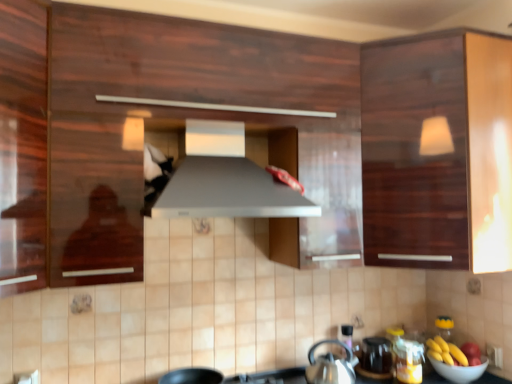
Question: Can we say matte black kettle at lower center lies outside glossy wood cabinet at upper right?

Choices:
 (A) no
 (B) yes

Answer: (B)

Question: Are matte black kettle at lower center and glossy wood cabinet at upper right located far from each other?

Choices:
 (A) yes
 (B) no

Answer: (B)

Question: Is matte black kettle at lower center turned away from glossy wood cabinet at upper right?

Choices:
 (A) yes
 (B) no

Answer: (B)

Question: Does matte black kettle at lower center have a lesser width compared to glossy wood cabinet at upper right?

Choices:
 (A) no
 (B) yes

Answer: (B)

Question: From the image's perspective, is matte black kettle at lower center above glossy wood cabinet at upper right?

Choices:
 (A) no
 (B) yes

Answer: (A)

Question: Considering the positions of point (434, 350) and point (262, 198), is point (434, 350) closer or farther from the camera than point (262, 198)?

Choices:
 (A) farther
 (B) closer

Answer: (A)

Question: From the image's perspective, is yellow matte bananas at lower right positioned above or below satin silver exhaust hood at center?

Choices:
 (A) below
 (B) above

Answer: (A)

Question: Is yellow matte bananas at lower right wider or thinner than satin silver exhaust hood at center?

Choices:
 (A) wide
 (B) thin

Answer: (B)

Question: Considering the positions of yellow matte bananas at lower right and satin silver exhaust hood at center in the image, is yellow matte bananas at lower right bigger or smaller than satin silver exhaust hood at center?

Choices:
 (A) big
 (B) small

Answer: (B)

Question: In terms of width, does satin silver exhaust hood at center look wider or thinner when compared to silver metallic kettle at lower center?

Choices:
 (A) thin
 (B) wide

Answer: (B)

Question: Is satin silver exhaust hood at center inside the boundaries of silver metallic kettle at lower center, or outside?

Choices:
 (A) outside
 (B) inside

Answer: (A)

Question: From a real-world perspective, relative to silver metallic kettle at lower center, is satin silver exhaust hood at center vertically above or below?

Choices:
 (A) above
 (B) below

Answer: (A)

Question: Is point (311, 210) closer or farther from the camera than point (324, 362)?

Choices:
 (A) farther
 (B) closer

Answer: (B)

Question: Is satin silver exhaust hood at center wider or thinner than yellow matte bananas at lower right?

Choices:
 (A) thin
 (B) wide

Answer: (B)

Question: Based on their sizes in the image, would you say satin silver exhaust hood at center is bigger or smaller than yellow matte bananas at lower right?

Choices:
 (A) small
 (B) big

Answer: (B)